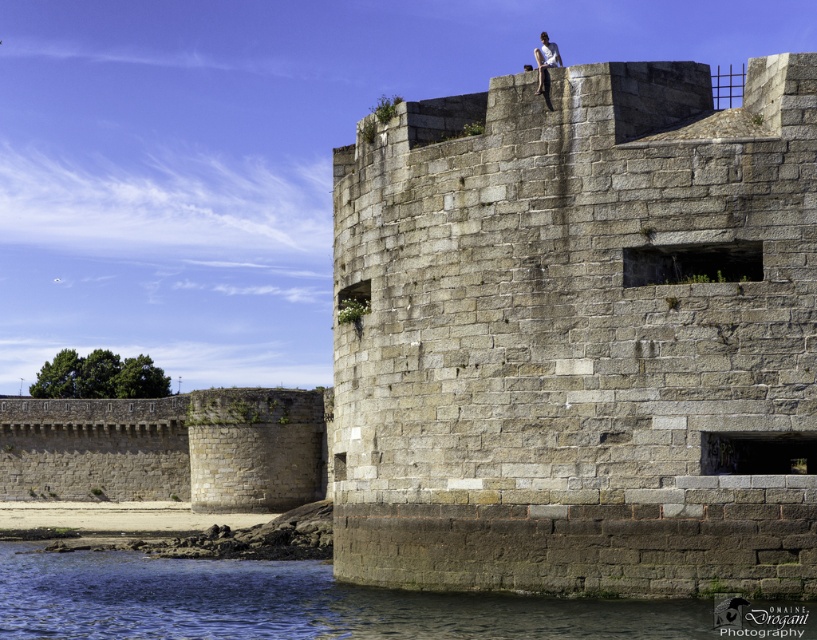
Question: Is gray stone wall at upper center bigger than blue water at lower left?

Choices:
 (A) no
 (B) yes

Answer: (A)

Question: Which of the following is the farthest from the observer?

Choices:
 (A) gray stone wall at upper center
 (B) blue water at lower left
 (C) white fabric shirt at upper center

Answer: (C)

Question: Does blue water at lower left appear over white fabric shirt at upper center?

Choices:
 (A) yes
 (B) no

Answer: (B)

Question: Does gray stone wall at upper center have a lesser width compared to white fabric shirt at upper center?

Choices:
 (A) yes
 (B) no

Answer: (B)

Question: Which of the following is the closest to the observer?

Choices:
 (A) (550, 45)
 (B) (715, 188)

Answer: (B)

Question: Which point is farther to the camera?

Choices:
 (A) gray stone wall at upper center
 (B) white fabric shirt at upper center

Answer: (B)